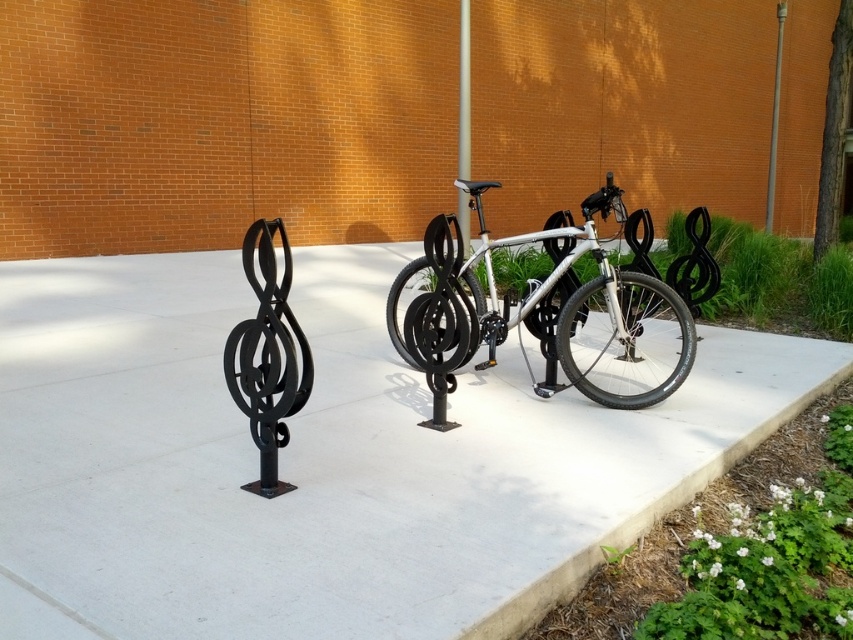
You are standing at the point marked by coordinates point (325, 460). Looking around, you see the white concrete pavement at center and the bike rack shaped like musical treble clefs. Which object are you currently standing on?

You are standing on the white concrete pavement at center located at point (325, 460).

You are a delivery person who needs to park your bike. You see a silver metallic bicycle at center and a silver metallic pole at center. Which one is larger in size so you can choose a parking spot accordingly?

The silver metallic bicycle at center is bigger than the silver metallic pole at center, so you should choose a parking spot that can accommodate its larger size.